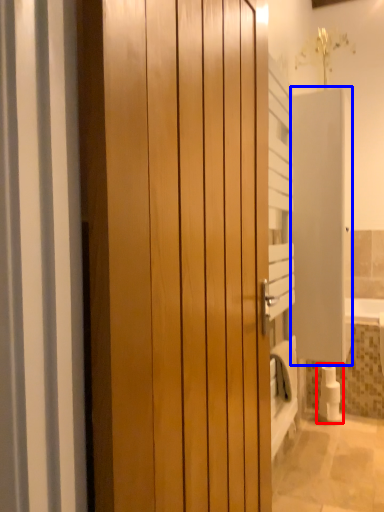
Question: Which of the following is the farthest to the observer, toilet paper (highlighted by a red box) or screen door (highlighted by a blue box)?

Choices:
 (A) toilet paper
 (B) screen door

Answer: (A)